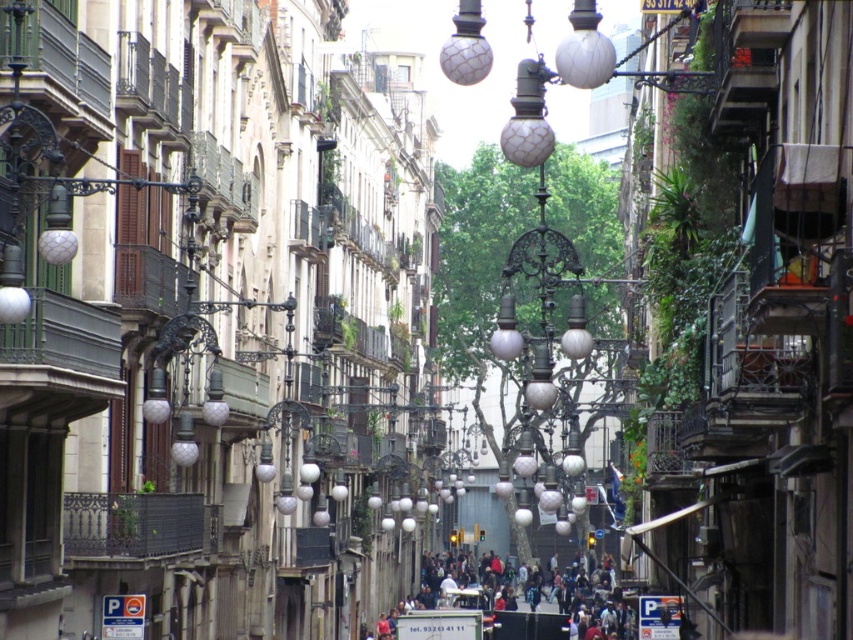
You are a delivery person trying to navigate through the narrow street. You see the matte glass lamp post at center and the dark gray concrete crowd at center. Which object is positioned higher from the ground?

The matte glass lamp post at center is located above the dark gray concrete crowd at center, so it is positioned higher from the ground.

You are standing at the entrance of the street and want to reach the matte glass lamp post at center. According to the image, in which direction should you walk from your current position to reach it?

The matte glass lamp post at center is located at point coordinates, so you should walk towards the center of the street from the entrance to reach it.

You are a delivery person with a cart that is 3 feet wide. You need to navigate through the narrow urban street shown in the image. There is a matte glass lamp post at center and a dark gray concrete crowd at center. Can your cart pass between them without touching either?

The distance between the matte glass lamp post at center and the dark gray concrete crowd at center is 54.92 feet. Since your cart is only 3 feet wide, there is ample space for it to pass through without touching either object.